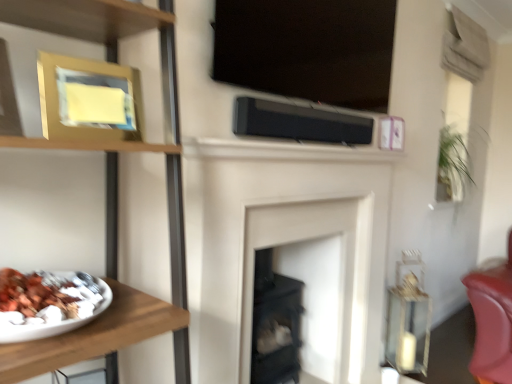
Where is `free spot above white matte fireplace at center (from a real-world perspective)`? The height and width of the screenshot is (384, 512). free spot above white matte fireplace at center (from a real-world perspective) is located at coordinates (302, 165).